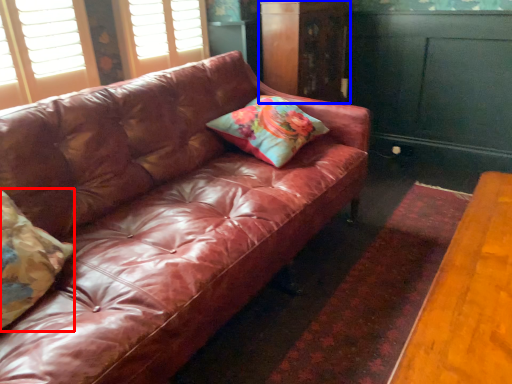
Question: Which of the following is the farthest to the observer, pillow (highlighted by a red box) or dresser (highlighted by a blue box)?

Choices:
 (A) pillow
 (B) dresser

Answer: (B)